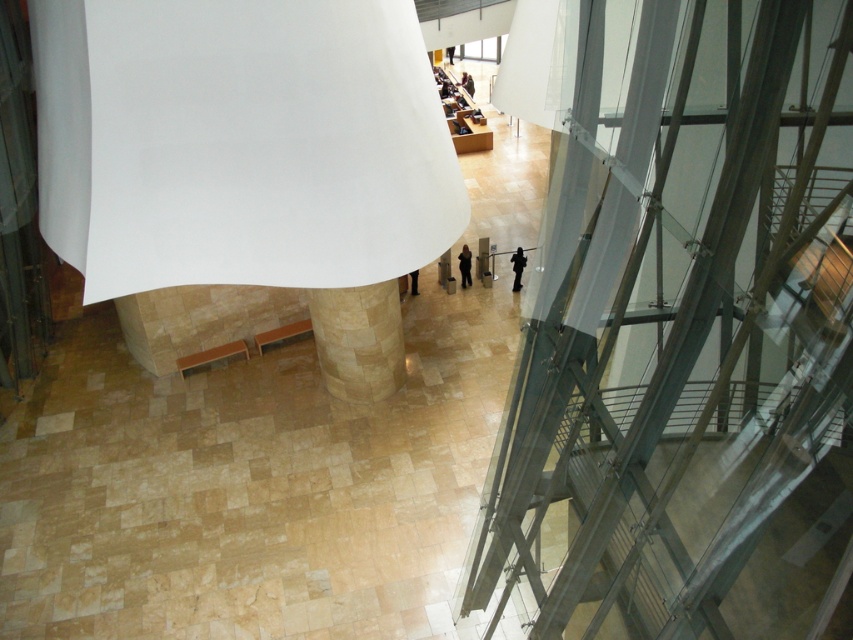
You are standing in the modern building and want to approach the black leather pants at center. The black matte person at center is blocking your path. Can you walk around them without getting too close? Please explain using the distance provided.

The distance between the black matte person at center and the black leather pants at center is 9.40 feet. Since the person is blocking your path, you can easily walk around them while maintaining a comfortable distance of approximately 9.40 feet, which is more than enough space to maneuver safely.

From the picture: You are standing at the entrance of the modern building and see the black matte person at center. If you want to approach them, which direction should you move relative to your current position?

The black matte person at center is located at point [517,268], so you should move towards the center of the image to reach them.